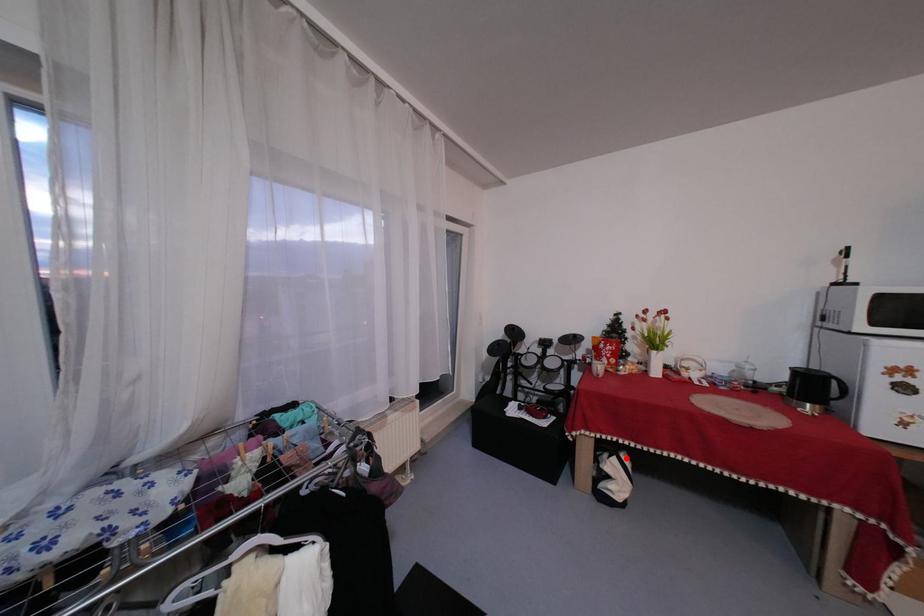
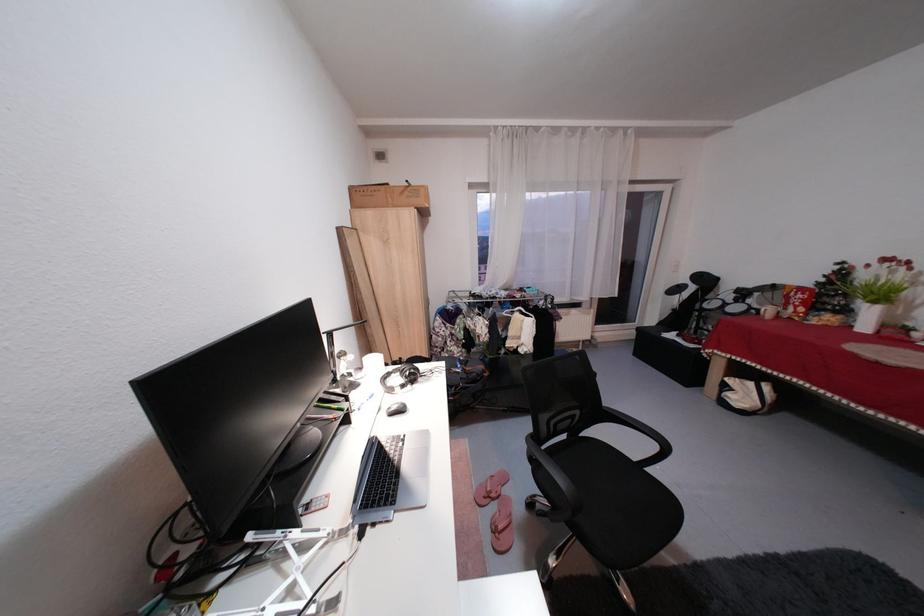
Question: I am providing you with two images of the same scene from different viewpoints. In image1, a red point is highlighted. Considering the same 3D point in image2, which of the following is correct?

Choices:
 (A) It is closer
 (B) It is farther

Answer: (A)